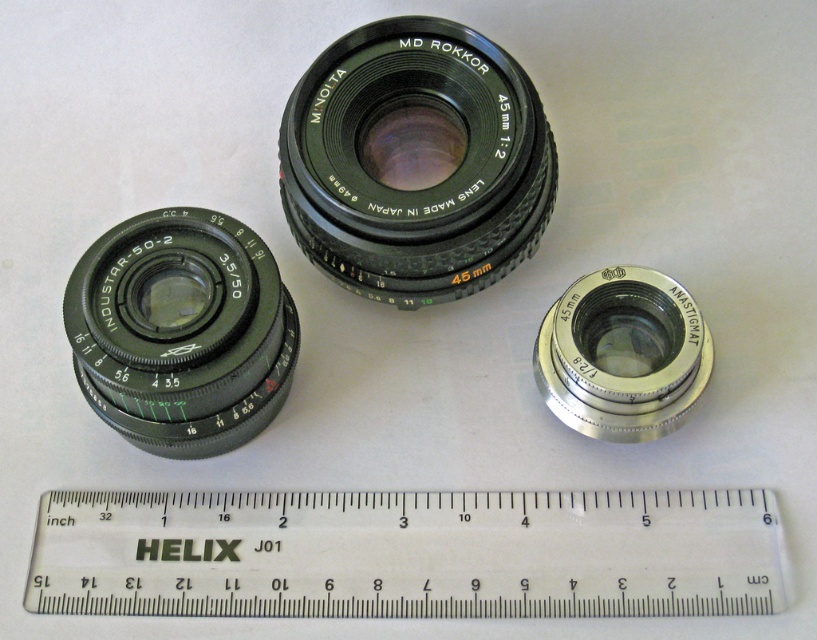
Does white plastic ruler at bottom appear over matte black lens at lower left?

No, white plastic ruler at bottom is not above matte black lens at lower left.

The image size is (817, 640). I want to click on white plastic ruler at bottom, so pos(408,554).

The image size is (817, 640). In order to click on white plastic ruler at bottom in this screenshot , I will do (408, 554).

Between matte black lens at lower left and silver metallic anastigmat at center, which one has less height?

Standing shorter between the two is silver metallic anastigmat at center.

This screenshot has height=640, width=817. Find the location of `matte black lens at lower left`. matte black lens at lower left is located at coordinates (181, 332).

Does black plastic lens at upper center appear on the left side of matte black lens at lower left?

No, black plastic lens at upper center is not to the left of matte black lens at lower left.

Does black plastic lens at upper center have a smaller size compared to matte black lens at lower left?

Incorrect, black plastic lens at upper center is not smaller in size than matte black lens at lower left.

Does point (465, 288) come in front of point (135, 256)?

No.

Where is `black plastic lens at upper center`? This screenshot has height=640, width=817. black plastic lens at upper center is located at coordinates (414, 161).